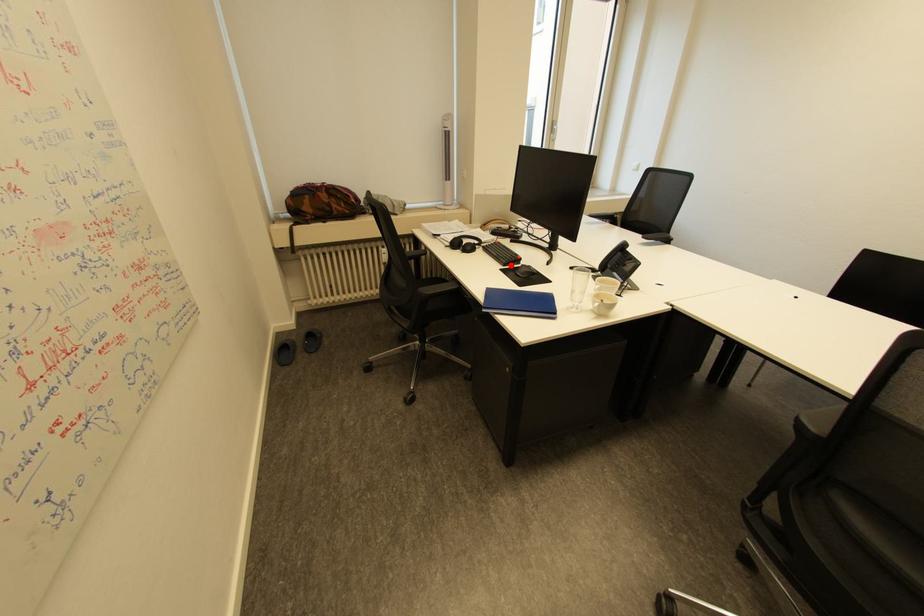
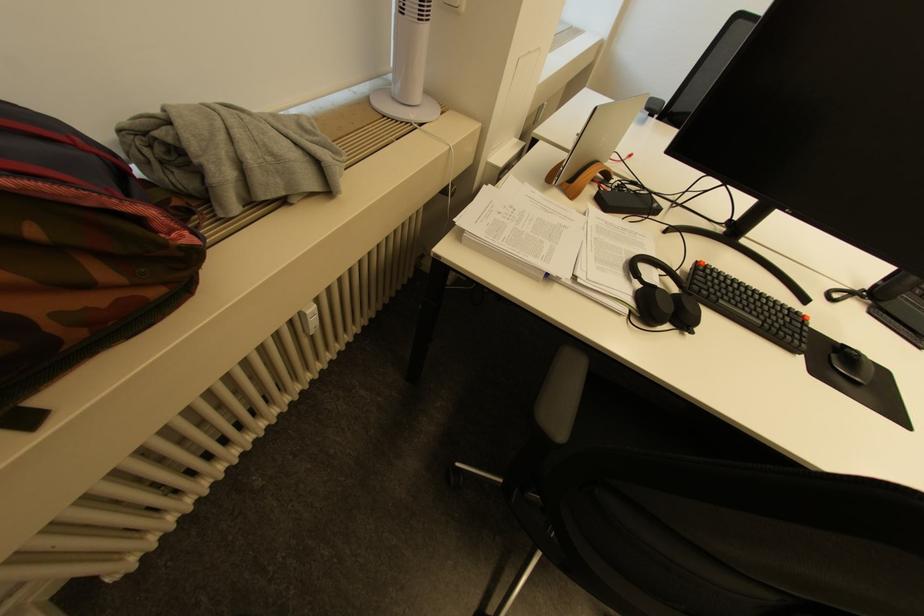
In the second image, find the point that corresponds to the highlighted location in the first image.

(800, 351)